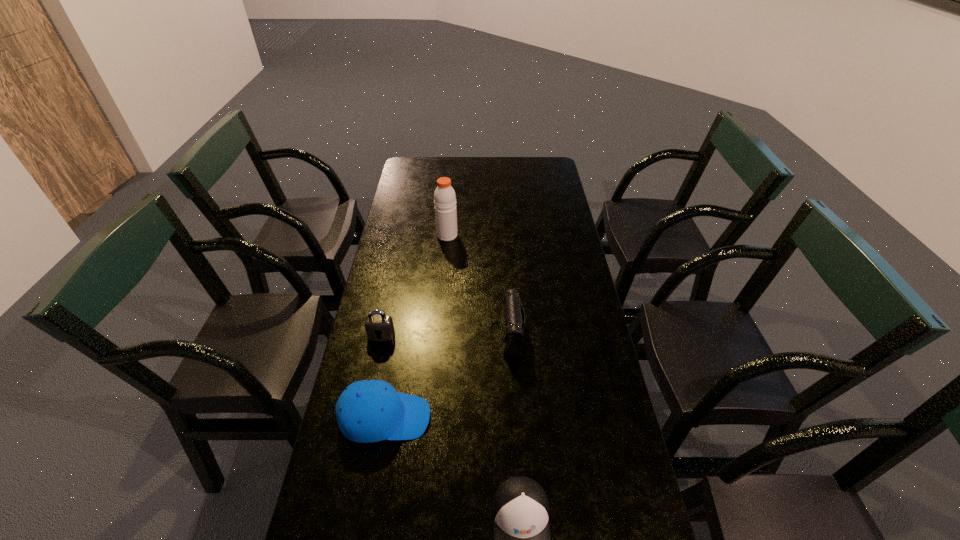
Locate an element on the screen. This screenshot has width=960, height=540. shaker is located at coordinates click(x=444, y=196).

Where is `the tallest object`? This screenshot has height=540, width=960. the tallest object is located at coordinates (444, 196).

This screenshot has width=960, height=540. Find the location of `padlock`. padlock is located at coordinates (379, 327).

You are a GUI agent. You are given a task and a screenshot of the screen. Output one action in this format:
    pyautogui.click(x=<x>, y=<y>)
    Task: Click on the clutch bag
    
    Given the screenshot: What is the action you would take?
    pyautogui.click(x=512, y=315)

You are a GUI agent. You are given a task and a screenshot of the screen. Output one action in this format:
    pyautogui.click(x=<x>, y=<y>)
    Task: Click on the taller cap
    This screenshot has width=960, height=540.
    Given the screenshot: What is the action you would take?
    pyautogui.click(x=368, y=411)

This screenshot has height=540, width=960. What are the coordinates of `the fourth farthest object` in the screenshot? It's located at pyautogui.click(x=368, y=411).

At what (x,y) coordinates should I click in order to perform the action: click on vacant position located on the back of the tallest object. Please return your answer as a coordinate pair (x, y). The width and height of the screenshot is (960, 540). Looking at the image, I should click on (451, 190).

Identify the location of free space located at the front of the padlock near the keyhole. (365, 416).

This screenshot has height=540, width=960. In order to click on vacant space located 0.380m on the front flap of the clutch bag in this screenshot , I will do `click(367, 334)`.

Identify the location of vacant space located 0.370m on the front flap of the clutch bag. (371, 334).